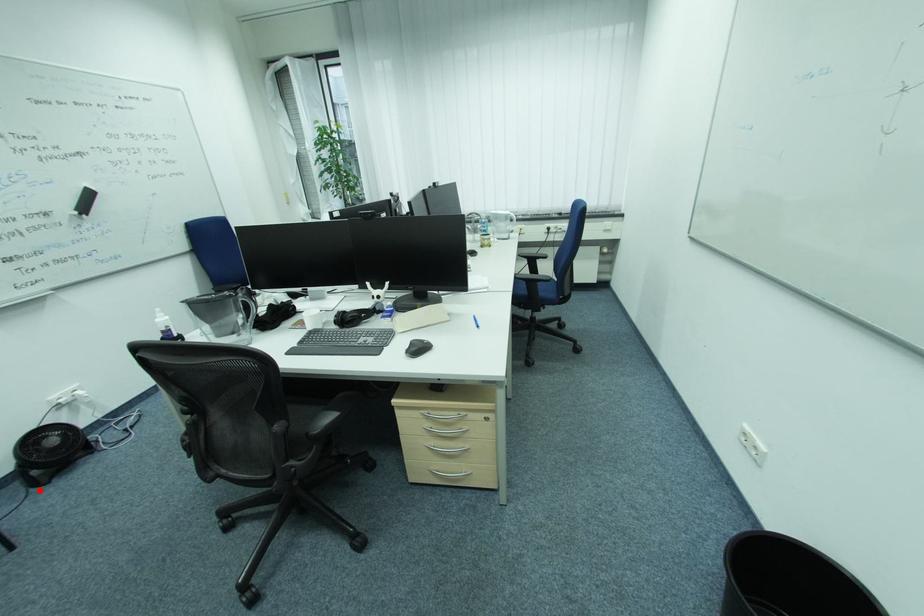
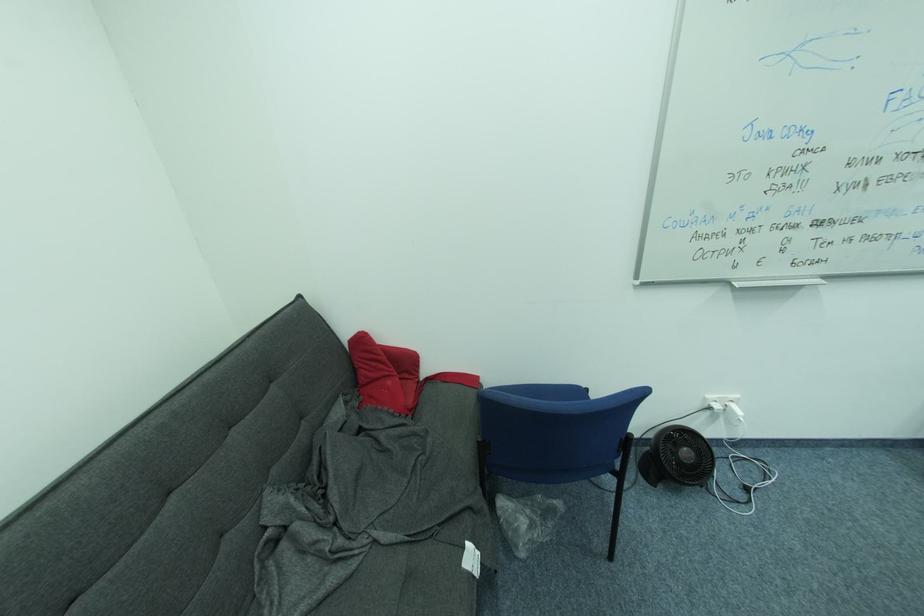
Where in the second image is the point corresponding to the highlighted location from the first image?

(648, 479)